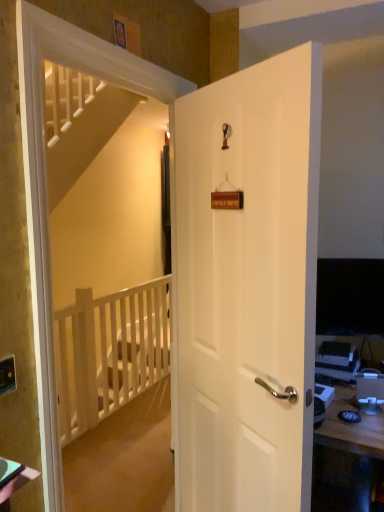
Question: Does matte black desktop computer at right have a lesser height compared to white matte door at center?

Choices:
 (A) no
 (B) yes

Answer: (B)

Question: From a real-world perspective, is matte black desktop computer at right on white matte door at center?

Choices:
 (A) no
 (B) yes

Answer: (A)

Question: Is matte black desktop computer at right aimed at white matte door at center?

Choices:
 (A) no
 (B) yes

Answer: (A)

Question: Is the depth of matte black desktop computer at right greater than that of white matte door at center?

Choices:
 (A) yes
 (B) no

Answer: (A)

Question: Can you confirm if matte black desktop computer at right is taller than white matte door at center?

Choices:
 (A) yes
 (B) no

Answer: (B)

Question: From the image's perspective, relative to matte black desktop computer at right, is white wooden balustrade at left above or below?

Choices:
 (A) above
 (B) below

Answer: (B)

Question: Is white wooden balustrade at left inside the boundaries of matte black desktop computer at right, or outside?

Choices:
 (A) outside
 (B) inside

Answer: (A)

Question: Based on their sizes in the image, would you say white wooden balustrade at left is bigger or smaller than matte black desktop computer at right?

Choices:
 (A) small
 (B) big

Answer: (B)

Question: Considering their positions, is white wooden balustrade at left located in front of or behind matte black desktop computer at right?

Choices:
 (A) front
 (B) behind

Answer: (B)

Question: In terms of height, does white wooden balustrade at left look taller or shorter compared to matte black outlet at lower left?

Choices:
 (A) short
 (B) tall

Answer: (B)

Question: From the image's perspective, relative to matte black outlet at lower left, is white wooden balustrade at left above or below?

Choices:
 (A) above
 (B) below

Answer: (B)

Question: Considering the positions of white wooden balustrade at left and matte black outlet at lower left in the image, is white wooden balustrade at left wider or thinner than matte black outlet at lower left?

Choices:
 (A) thin
 (B) wide

Answer: (B)

Question: Which is correct: white wooden balustrade at left is inside matte black outlet at lower left, or outside of it?

Choices:
 (A) inside
 (B) outside

Answer: (B)

Question: Is matte black desktop computer at right spatially inside white wooden balustrade at left, or outside of it?

Choices:
 (A) inside
 (B) outside

Answer: (B)

Question: From the image's perspective, relative to white wooden balustrade at left, is matte black desktop computer at right above or below?

Choices:
 (A) above
 (B) below

Answer: (A)